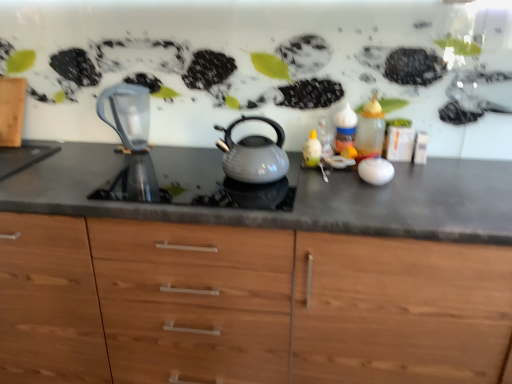
Find the location of a particular element. The height and width of the screenshot is (384, 512). empty space that is to the right of matte gray kettle at center is located at coordinates (317, 178).